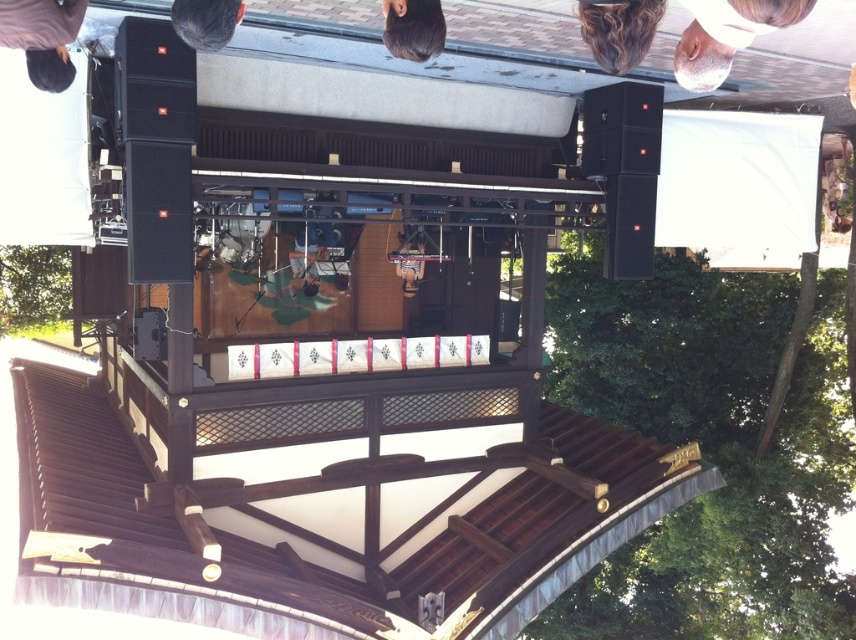
Between dark brown sweater at upper left and dark brown hair at upper left, which one is positioned lower?

dark brown sweater at upper left

Does point (51, 22) lie behind point (223, 33)?

No, (51, 22) is in front of (223, 33).

Who is more distant from viewer, (0, 33) or (242, 16)?

Positioned behind is point (242, 16).

At what (x,y) coordinates should I click in order to perform the action: click on dark brown sweater at upper left. Please return your answer as a coordinate pair (x, y). Image resolution: width=856 pixels, height=640 pixels. Looking at the image, I should click on (42, 36).

Is dark brown hair at upper center thinner than dark brown hair at upper left?

Yes, dark brown hair at upper center is thinner than dark brown hair at upper left.

Does dark brown hair at upper center lie in front of dark brown hair at upper left?

That is False.

At what (x,y) coordinates should I click in order to perform the action: click on dark brown hair at upper center. Please return your answer as a coordinate pair (x, y). The height and width of the screenshot is (640, 856). Looking at the image, I should click on (413, 28).

In the scene shown: Which of these two, white matte hair at upper center or dark brown hair at upper center, stands taller?

white matte hair at upper center

Which of these two, white matte hair at upper center or dark brown hair at upper center, stands shorter?

dark brown hair at upper center

Between point (629, 60) and point (402, 26), which one is positioned behind?

The point (629, 60) is more distant.

Image resolution: width=856 pixels, height=640 pixels. I want to click on white matte hair at upper center, so click(726, 35).